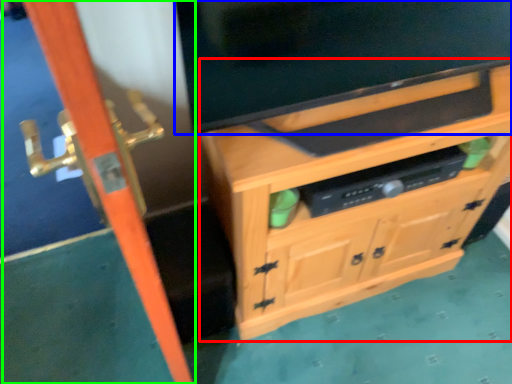
Question: Considering the real-world distances, which object is farthest from cabinetry (highlighted by a red box)? television (highlighted by a blue box) or screen door (highlighted by a green box)?

Choices:
 (A) television
 (B) screen door

Answer: (B)